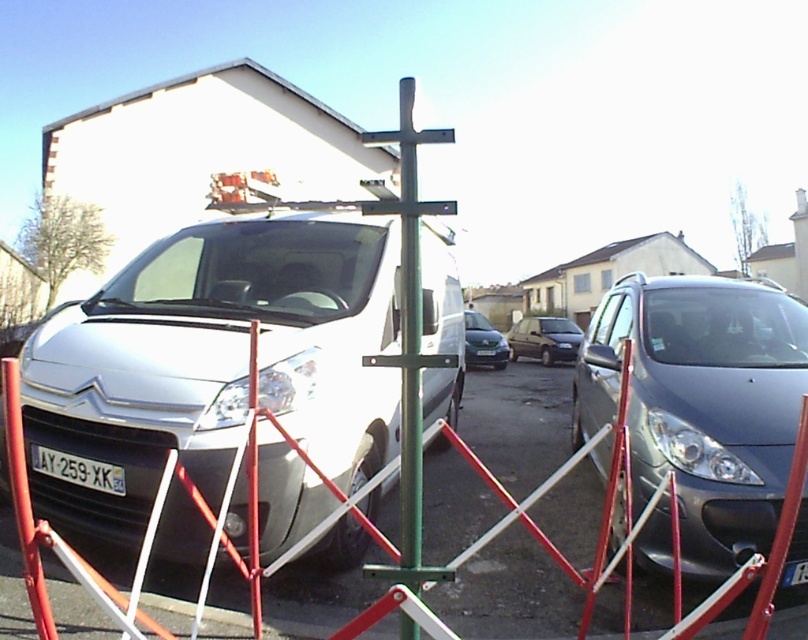
Between point (571, 340) and point (785, 579), which one is positioned behind?

The point (571, 340) is behind.

Is dark gray metallic hatchback at center positioned before yellow matte license plate at center?

No, it is behind yellow matte license plate at center.

Describe the element at coordinates (545, 339) in the screenshot. Image resolution: width=808 pixels, height=640 pixels. I see `dark gray metallic hatchback at center` at that location.

Find the location of a particular element. dark gray metallic hatchback at center is located at coordinates (545, 339).

Looking at this image, who is positioned more to the left, green metallic cross at center or silver metallic hatchback at center?

green metallic cross at center is more to the left.

Is point (406, 394) farther from viewer compared to point (469, 310)?

No, it is not.

Where is `green metallic cross at center`? The image size is (808, 640). green metallic cross at center is located at coordinates (409, 336).

Which is in front, point (709, 282) or point (411, 250)?

Point (411, 250) is more forward.

Is metallic gray minivan at right to the right of green metallic cross at center from the viewer's perspective?

Correct, you'll find metallic gray minivan at right to the right of green metallic cross at center.

Is point (724, 342) in front of point (410, 477)?

No, (724, 342) is behind (410, 477).

The width and height of the screenshot is (808, 640). Find the location of `metallic gray minivan at right`. metallic gray minivan at right is located at coordinates (701, 403).